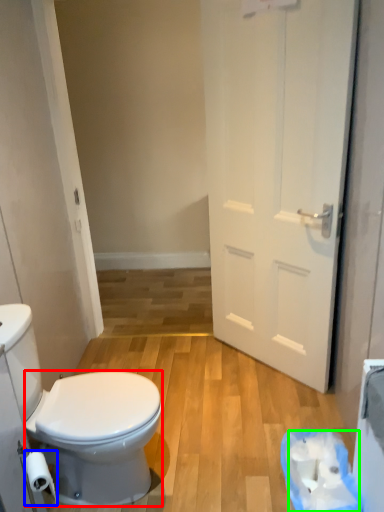
Question: Considering the real-world distances, which object is farthest from bidet (highlighted by a red box)? toilet paper (highlighted by a blue box) or toilet paper (highlighted by a green box)?

Choices:
 (A) toilet paper
 (B) toilet paper

Answer: (B)